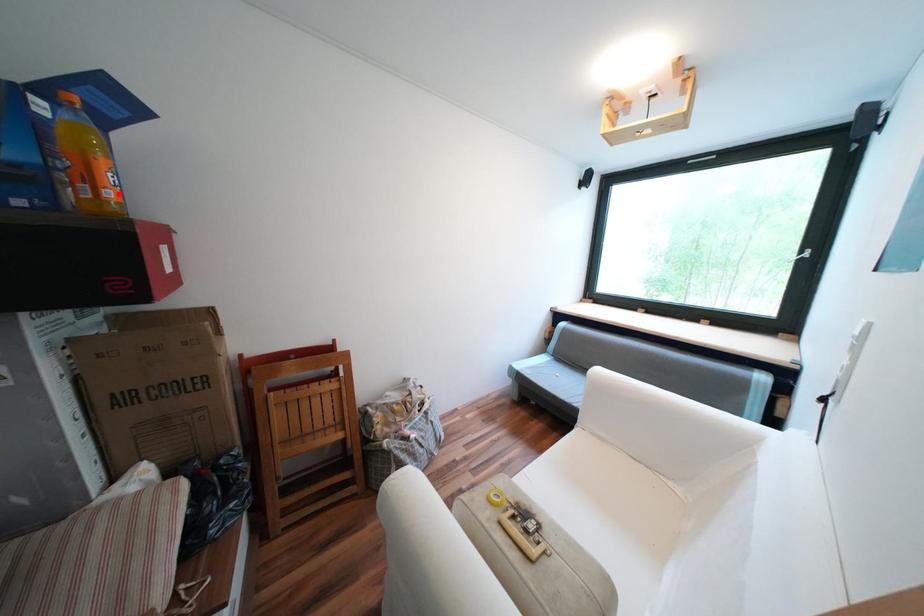
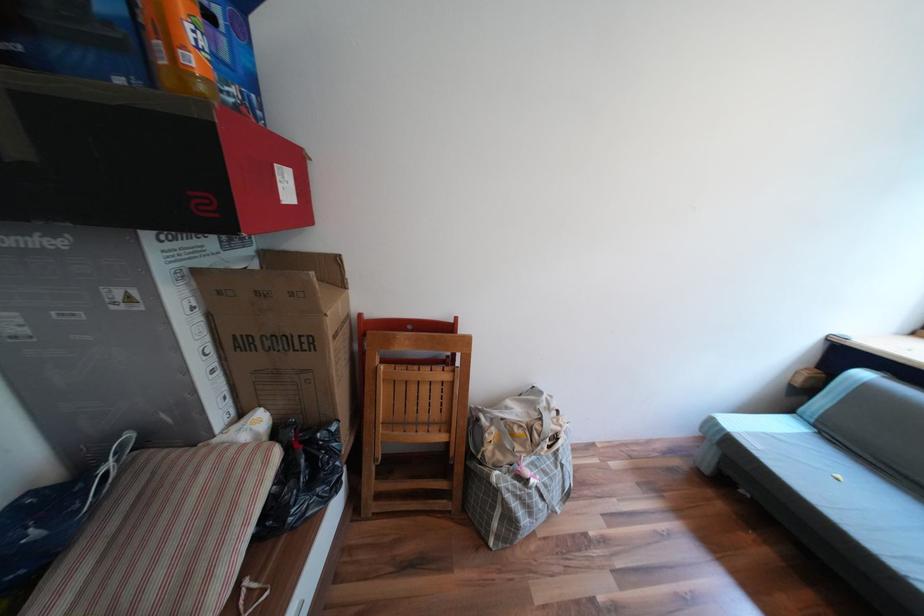
Where in the second image is the point corresponding to the highlighted location from the first image?

(201, 61)